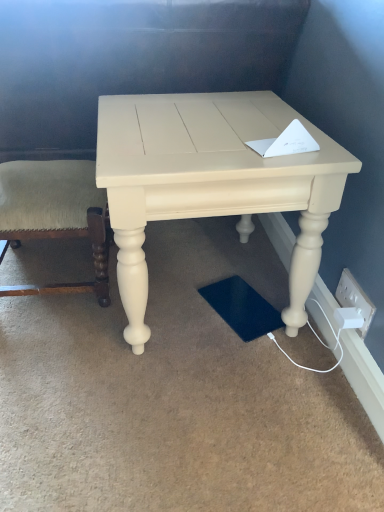
Question: Is white plastic electric outlet at lower right wider than matte cream table at center?

Choices:
 (A) yes
 (B) no

Answer: (B)

Question: Are white plastic electric outlet at lower right and matte cream table at center beside each other?

Choices:
 (A) no
 (B) yes

Answer: (A)

Question: Is white plastic electric outlet at lower right positioned far away from matte cream table at center?

Choices:
 (A) yes
 (B) no

Answer: (B)

Question: Is white plastic electric outlet at lower right to the left of matte cream table at center from the viewer's perspective?

Choices:
 (A) yes
 (B) no

Answer: (B)

Question: Does white plastic electric outlet at lower right have a lesser width compared to matte cream table at center?

Choices:
 (A) no
 (B) yes

Answer: (B)

Question: From a real-world perspective, is white plastic socket at lower right positioned above or below green fabric cushion at left?

Choices:
 (A) above
 (B) below

Answer: (B)

Question: Looking at their shapes, would you say white plastic socket at lower right is wider or thinner than green fabric cushion at left?

Choices:
 (A) thin
 (B) wide

Answer: (A)

Question: In terms of size, does white plastic socket at lower right appear bigger or smaller than green fabric cushion at left?

Choices:
 (A) small
 (B) big

Answer: (A)

Question: Is white plastic socket at lower right inside or outside of green fabric cushion at left?

Choices:
 (A) outside
 (B) inside

Answer: (A)

Question: Do you think matte cream table at center is within white plastic socket at lower right, or outside of it?

Choices:
 (A) outside
 (B) inside

Answer: (A)

Question: In terms of width, does matte cream table at center look wider or thinner when compared to white plastic socket at lower right?

Choices:
 (A) wide
 (B) thin

Answer: (A)

Question: In terms of height, does matte cream table at center look taller or shorter compared to white plastic socket at lower right?

Choices:
 (A) short
 (B) tall

Answer: (B)

Question: From a real-world perspective, is matte cream table at center positioned above or below white plastic socket at lower right?

Choices:
 (A) above
 (B) below

Answer: (A)

Question: From the image's perspective, is green fabric cushion at left above or below matte cream table at center?

Choices:
 (A) below
 (B) above

Answer: (A)

Question: From a real-world perspective, is green fabric cushion at left above or below matte cream table at center?

Choices:
 (A) above
 (B) below

Answer: (B)